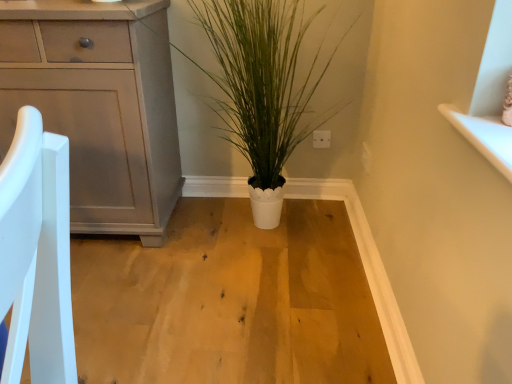
Question: Considering the positions of matte gray cabinet at left and white textured pot at center in the image, is matte gray cabinet at left wider or thinner than white textured pot at center?

Choices:
 (A) wide
 (B) thin

Answer: (B)

Question: Considering the positions of matte gray cabinet at left and white textured pot at center in the image, is matte gray cabinet at left bigger or smaller than white textured pot at center?

Choices:
 (A) small
 (B) big

Answer: (B)

Question: From a real-world perspective, relative to white textured pot at center, is matte gray cabinet at left vertically above or below?

Choices:
 (A) above
 (B) below

Answer: (B)

Question: Looking at the image, does white textured pot at center seem bigger or smaller compared to matte gray cabinet at left?

Choices:
 (A) small
 (B) big

Answer: (A)

Question: In terms of width, does white textured pot at center look wider or thinner when compared to matte gray cabinet at left?

Choices:
 (A) thin
 (B) wide

Answer: (B)

Question: Would you say white textured pot at center is to the left or to the right of matte gray cabinet at left in the picture?

Choices:
 (A) left
 (B) right

Answer: (B)

Question: From a real-world perspective, is white textured pot at center above or below matte gray cabinet at left?

Choices:
 (A) above
 (B) below

Answer: (A)